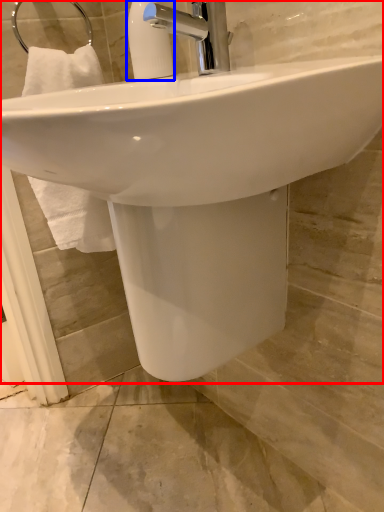
Question: Which of the following is the farthest to the observer, sink (highlighted by a red box) or soap dispenser (highlighted by a blue box)?

Choices:
 (A) sink
 (B) soap dispenser

Answer: (B)